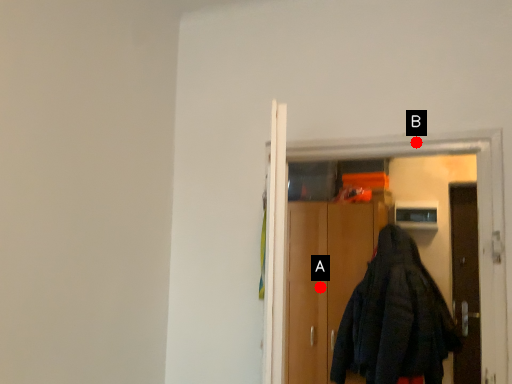
Question: Two points are circled on the image, labeled by A and B beside each circle. Among these points, which one is nearest to the camera?

Choices:
 (A) A is closer
 (B) B is closer

Answer: (B)